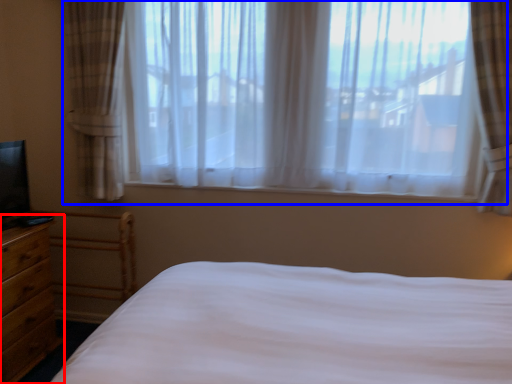
Question: Among these objects, which one is nearest to the camera, nightstand (highlighted by a red box) or window (highlighted by a blue box)?

Choices:
 (A) nightstand
 (B) window

Answer: (A)